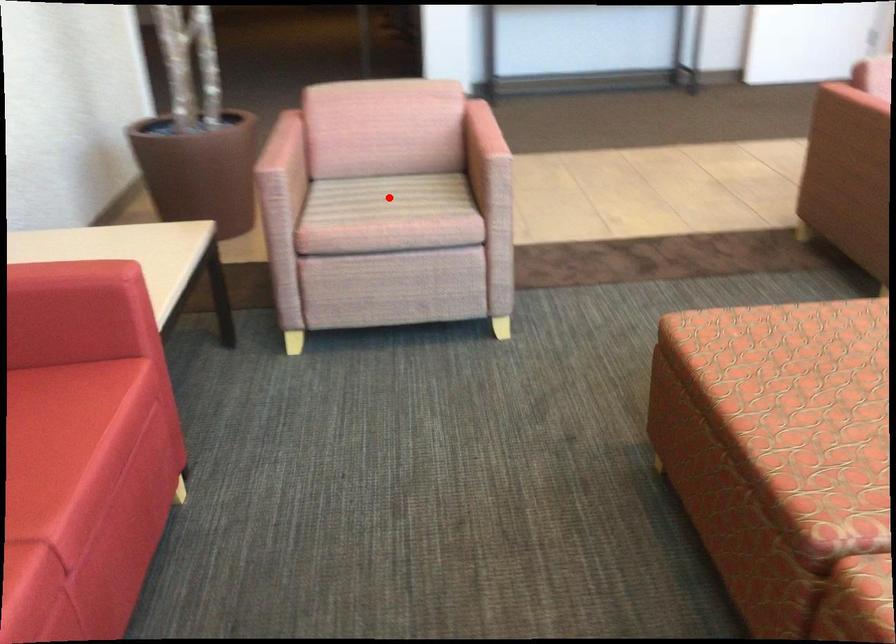
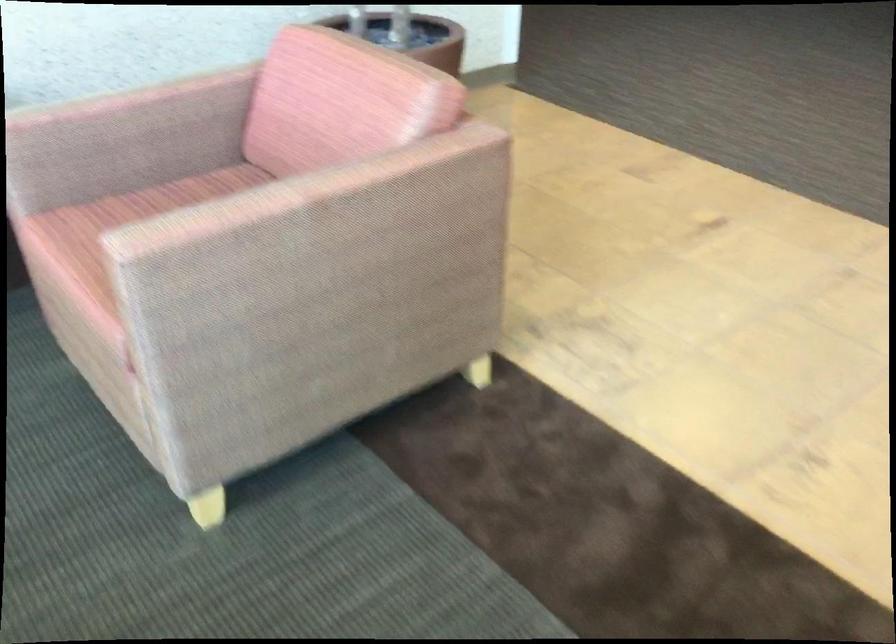
Question: I am providing you with two images of the same scene from different viewpoints. A red point is marked on the first image. Can you still see the location of the red point in image 2?

Choices:
 (A) Yes
 (B) No

Answer: (B)